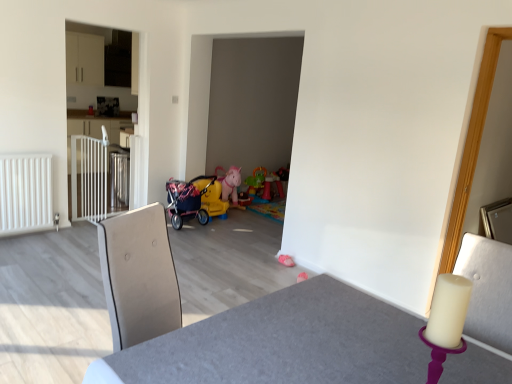
I want to click on yellow plastic baby carriage at center, so click(211, 196).

This screenshot has height=384, width=512. I want to click on pink fabric toy at lower center, positioned as the 2th toy in top-to-bottom order, so click(x=286, y=260).

The width and height of the screenshot is (512, 384). What do you see at coordinates (91, 177) in the screenshot?
I see `white metallic gate at left` at bounding box center [91, 177].

The width and height of the screenshot is (512, 384). Describe the element at coordinates (298, 345) in the screenshot. I see `smooth gray table at center` at that location.

This screenshot has height=384, width=512. Find the location of `yellow plastic baby carriage at center`. yellow plastic baby carriage at center is located at coordinates (211, 196).

Which is more to the left, white glossy cabinet at left or white matte radiator at left?

white matte radiator at left is more to the left.

Is white glossy cabinet at left aimed at white matte radiator at left?

No, white glossy cabinet at left is not aimed at white matte radiator at left.

Are white glossy cabinet at left and white matte radiator at left making contact?

white glossy cabinet at left and white matte radiator at left are clearly separated.

Is white glossy cabinet at left bigger or smaller than white matte radiator at left?

white glossy cabinet at left is bigger than white matte radiator at left.

From the image's perspective, is pink fabric toy at lower center, the first toy positioned from the bottom, located above or below white glossy cabinet at left?

pink fabric toy at lower center, the first toy positioned from the bottom, is situated lower than white glossy cabinet at left in the image.

Is point (280, 256) farther from viewer compared to point (104, 182)?

No, it is in front of (104, 182).

Considering the sizes of objects pink fabric toy at lower center, marked as the 2th toy in a back-to-front arrangement, and white glossy cabinet at left in the image provided, who is thinner, pink fabric toy at lower center, marked as the 2th toy in a back-to-front arrangement, or white glossy cabinet at left?

white glossy cabinet at left is thinner.

Would you consider pink fabric toy at lower center, positioned as the 2th toy in top-to-bottom order, to be distant from white glossy cabinet at left?

Yes, pink fabric toy at lower center, positioned as the 2th toy in top-to-bottom order, and white glossy cabinet at left are located far from each other.

Is smooth gray table at center oriented towards plastic rainbow play table at center, which is the 1th toy in top-to-bottom order?

No, smooth gray table at center is not aimed at plastic rainbow play table at center, which is the 1th toy in top-to-bottom order.

At what (x,y) coordinates should I click in order to perform the action: click on table above the plastic rainbow play table at center, which ranks as the second toy in front-to-back order (from a real-world perspective). Please return your answer as a coordinate pair (x, y). Image resolution: width=512 pixels, height=384 pixels. Looking at the image, I should click on (298, 345).

Can you confirm if smooth gray table at center is thinner than plastic rainbow play table at center, which is the 1th toy in top-to-bottom order?

Incorrect, the width of smooth gray table at center is not less than that of plastic rainbow play table at center, which is the 1th toy in top-to-bottom order.

Is white metallic gate at left touching white matte radiator at left?

They are not placed beside each other.

Is white metallic gate at left not within white matte radiator at left?

Indeed, white metallic gate at left is completely outside white matte radiator at left.

Considering the sizes of objects white metallic gate at left and white matte radiator at left in the image provided, who is taller, white metallic gate at left or white matte radiator at left?

white metallic gate at left is taller.

Can you confirm if white metallic gate at left is positioned to the left of white matte radiator at left?

Incorrect, white metallic gate at left is not on the left side of white matte radiator at left.

Who is taller, plastic rainbow play table at center, placed as the first toy when sorted from back to front, or smooth gray table at center?

smooth gray table at center.

Is plastic rainbow play table at center, which ranks as the second toy in front-to-back order, to the right of smooth gray table at center from the viewer's perspective?

Correct, you'll find plastic rainbow play table at center, which ranks as the second toy in front-to-back order, to the right of smooth gray table at center.

Which is farther from the camera, (x=250, y=190) or (x=376, y=352)?

Positioned behind is point (x=250, y=190).

Measure the distance between plastic rainbow play table at center, placed as the first toy when sorted from back to front, and smooth gray table at center.

A distance of 4.17 meters exists between plastic rainbow play table at center, placed as the first toy when sorted from back to front, and smooth gray table at center.

Is pink fabric toy at lower center, positioned as the 2th toy in top-to-bottom order, not close to smooth gray table at center?

Yes.

Considering the relative positions of pink fabric toy at lower center, the first toy positioned from the bottom, and smooth gray table at center in the image provided, is pink fabric toy at lower center, the first toy positioned from the bottom, in front of smooth gray table at center?

No, pink fabric toy at lower center, the first toy positioned from the bottom, is behind smooth gray table at center.

From their relative heights in the image, would you say pink fabric toy at lower center, the first toy positioned from the bottom, is taller or shorter than smooth gray table at center?

pink fabric toy at lower center, the first toy positioned from the bottom, is shorter than smooth gray table at center.

Does point (80, 145) come closer to viewer compared to point (116, 117)?

Yes, it is.

Would you say white glossy cabinet at left is part of white metallic gate at left's contents?

No, white glossy cabinet at left is not inside white metallic gate at left.

Could you tell me if white metallic gate at left is facing white glossy cabinet at left?

Yes, white metallic gate at left faces towards white glossy cabinet at left.

Where is `dresser above the white matte radiator at left (from a real-world perspective)`? The image size is (512, 384). dresser above the white matte radiator at left (from a real-world perspective) is located at coordinates (101, 57).

Identify the location of dresser on the left of the pink fabric toy at lower center, the first toy positioned from the bottom. Image resolution: width=512 pixels, height=384 pixels. (101, 57).

Considering their positions, is white glossy cabinet at left positioned closer to smooth gray table at center than white matte radiator at left?

The object closer to smooth gray table at center is white matte radiator at left.

From the image, which object appears to be farther from yellow plastic baby carriage at center, white glossy cabinet at left or pink fabric toy at lower center, marked as the 2th toy in a back-to-front arrangement?

white glossy cabinet at left is positioned further to the anchor yellow plastic baby carriage at center.

Considering their positions, is pink fabric toy at lower center, the first toy when ordered from front to back, positioned closer to plastic rainbow play table at center, which is the 1th toy in top-to-bottom order, than yellow plastic baby carriage at center?

Among the two, yellow plastic baby carriage at center is located nearer to plastic rainbow play table at center, which is the 1th toy in top-to-bottom order.

Which object lies nearer to the anchor point white matte radiator at left, white glossy cabinet at left or yellow plastic baby carriage at center?

yellow plastic baby carriage at center.

From the image, which object appears to be farther from white glossy cabinet at left, pink fabric toy at lower center, marked as the 2th toy in a back-to-front arrangement, or plastic rainbow play table at center, which ranks as the second toy in front-to-back order?

pink fabric toy at lower center, marked as the 2th toy in a back-to-front arrangement.

From the picture: Considering their positions, is white matte radiator at left positioned further to yellow plastic baby carriage at center than plastic rainbow play table at center, which is the 1th toy in top-to-bottom order?

white matte radiator at left lies further to yellow plastic baby carriage at center than the other object.

Estimate the real-world distances between objects in this image. Which object is further from plastic rainbow play table at center, which ranks as the second toy in front-to-back order, pink fabric toy at lower center, positioned as the 2th toy in top-to-bottom order, or smooth gray table at center?

Among the two, smooth gray table at center is located further to plastic rainbow play table at center, which ranks as the second toy in front-to-back order.

Based on their spatial positions, is white glossy cabinet at left or white matte radiator at left closer to pink fabric toy at lower center, the first toy positioned from the bottom?

Based on the image, white matte radiator at left appears to be nearer to pink fabric toy at lower center, the first toy positioned from the bottom.

This screenshot has width=512, height=384. I want to click on baby carriage situated between white glossy cabinet at left and pink fabric toy at lower center, positioned as the 2th toy in top-to-bottom order, from left to right, so click(211, 196).

Find the location of `rail located between smooth gray table at center and yellow plastic baby carriage at center in the depth direction`. rail located between smooth gray table at center and yellow plastic baby carriage at center in the depth direction is located at coordinates click(x=91, y=177).

This screenshot has width=512, height=384. In order to click on baby carriage between white matte radiator at left and plastic rainbow play table at center, placed as the first toy when sorted from back to front, from left to right in this screenshot , I will do point(211,196).

Where is `rail located between white matte radiator at left and plastic rainbow play table at center, placed as the 2th toy when sorted from bottom to top, in the left-right direction`? The width and height of the screenshot is (512, 384). rail located between white matte radiator at left and plastic rainbow play table at center, placed as the 2th toy when sorted from bottom to top, in the left-right direction is located at coordinates (91, 177).